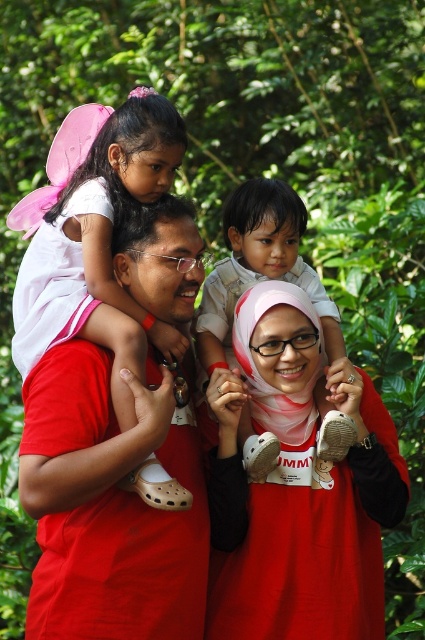
You are a photographer trying to adjust the lighting for a family photo. You notice two red items in the scene that might cast reflections. Which item is positioned lower in the image, the matte red shirt at center or the matte red hijab at center?

The matte red shirt at center is located below the matte red hijab at center, so it is positioned lower in the image.

You are a photographer adjusting the lighting for a family portrait. You notice two red items in the scene that might reflect light differently. Which item, the matte red shirt at center or the matte red hijab at center, do you think has a narrower width and might require less light adjustment?

The matte red shirt at center has a lesser width compared to the matte red hijab at center, so it might require less light adjustment due to its narrower size.